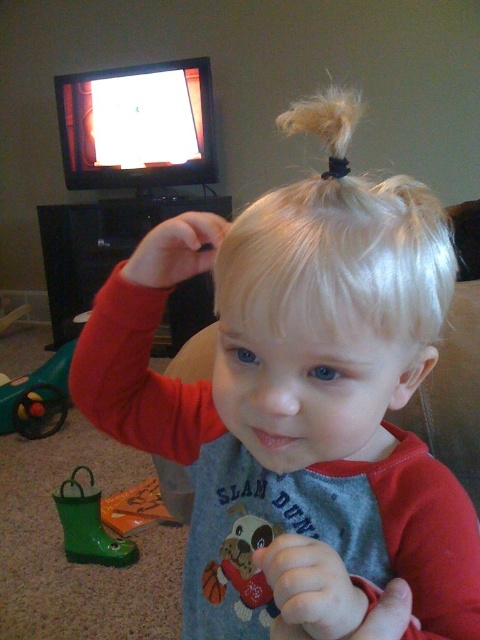
You are a parent trying to organize the living room. You see the green rubber toy at lower left and the green rubber boot at lower left. Can you place both items on a shelf that is 28 inches wide without moving them closer together?

The distance between the green rubber toy at lower left and green rubber boot at lower left is 31.00 inches, which is wider than the shelf. Therefore, they cannot be placed on the shelf without moving them closer together.

You are a parent trying to organize the living room. You see the green rubber toy at lower left and the rubber green boot at lower left. Which object is wider?

The green rubber toy at lower left is wider than the rubber green boot at lower left.

You are a parent trying to find your child a toy. You see the soft plush dog at center and the rubber green boot at lower left. Which toy is more to the right?

The soft plush dog at center is positioned on the right side of the rubber green boot at lower left, so it is more to the right.